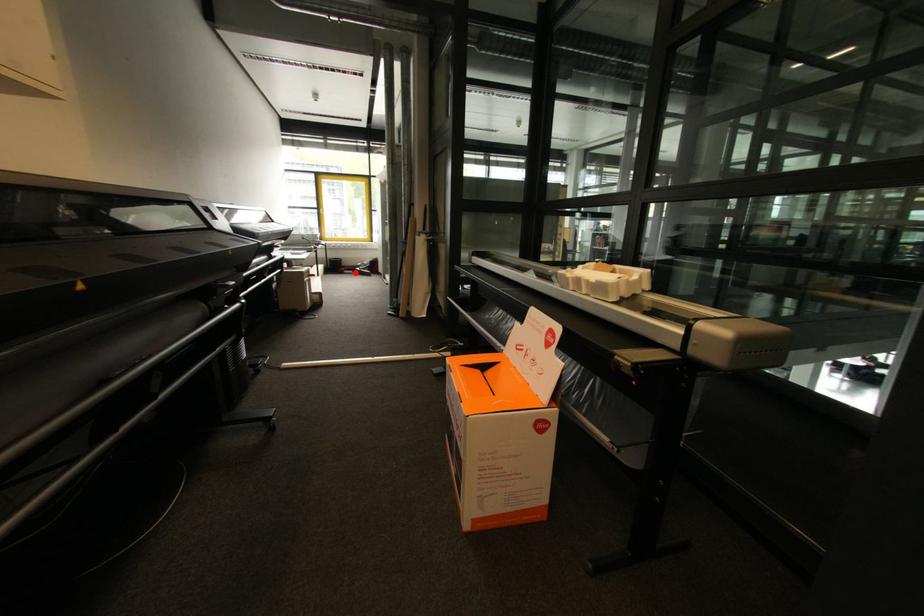
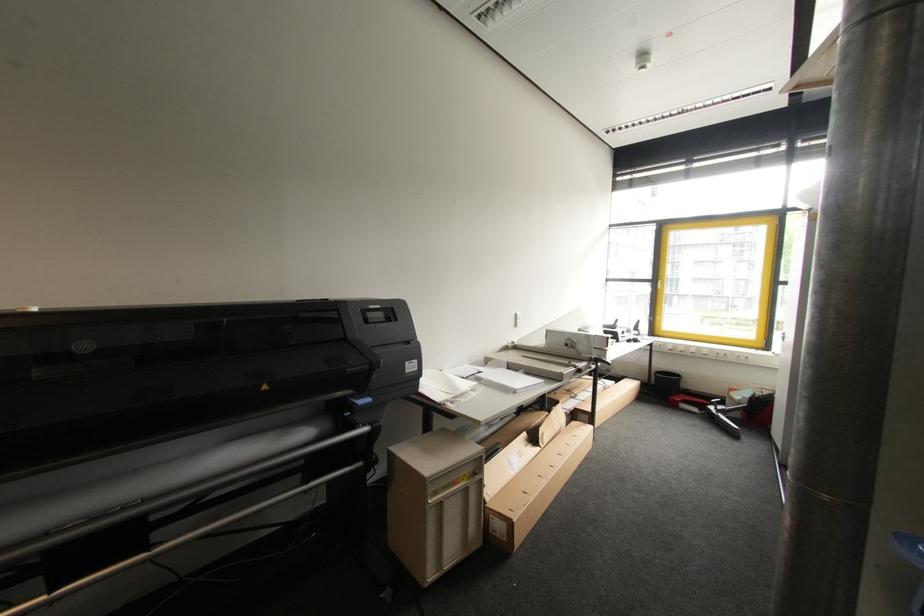
Question: I am providing you with two images of the same scene from different viewpoints. A red point is shown in image1. For the corresponding object point in image2, is it positioned nearer or farther from the camera?

Choices:
 (A) Nearer
 (B) Farther

Answer: (B)